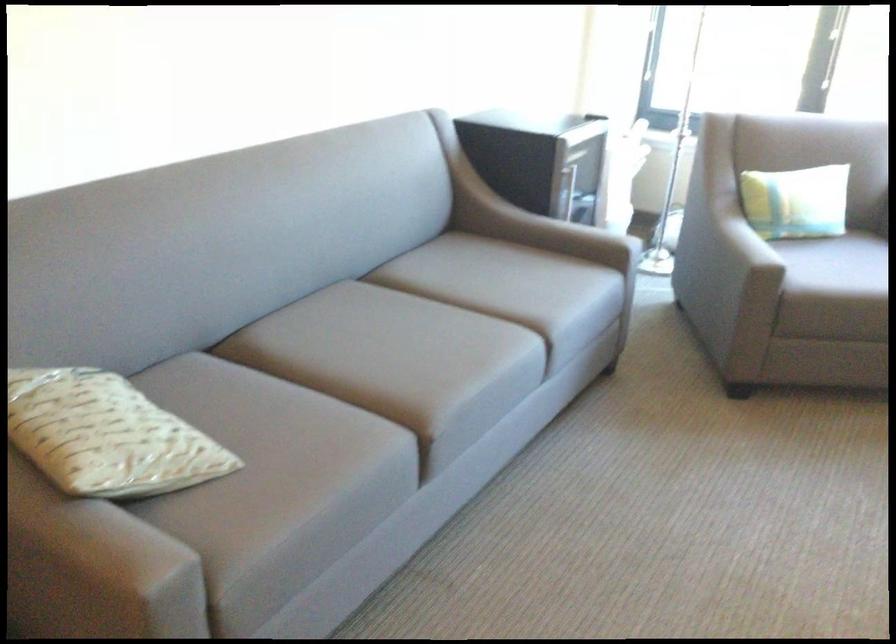
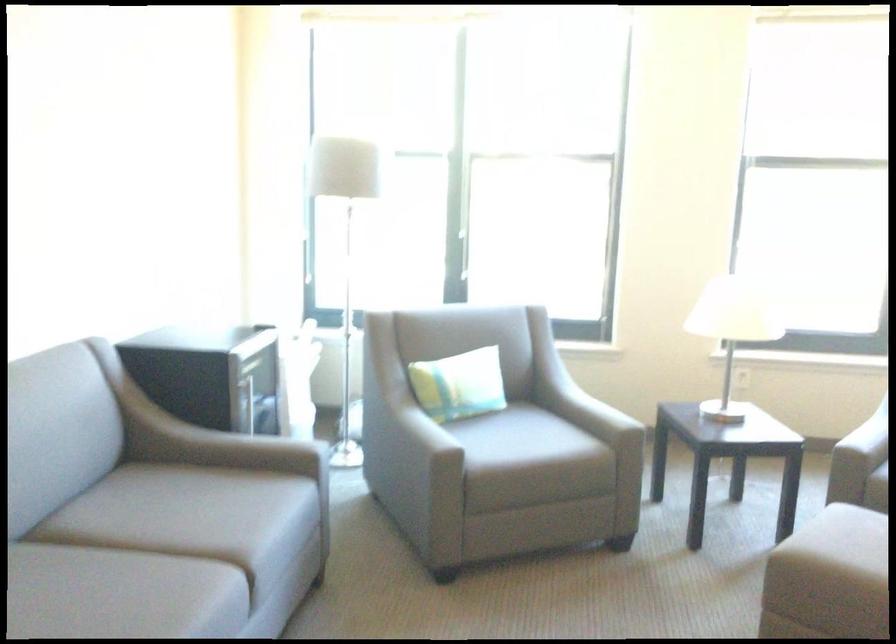
Locate, in the second image, the point that corresponds to (673,225) in the first image.

(356, 420)